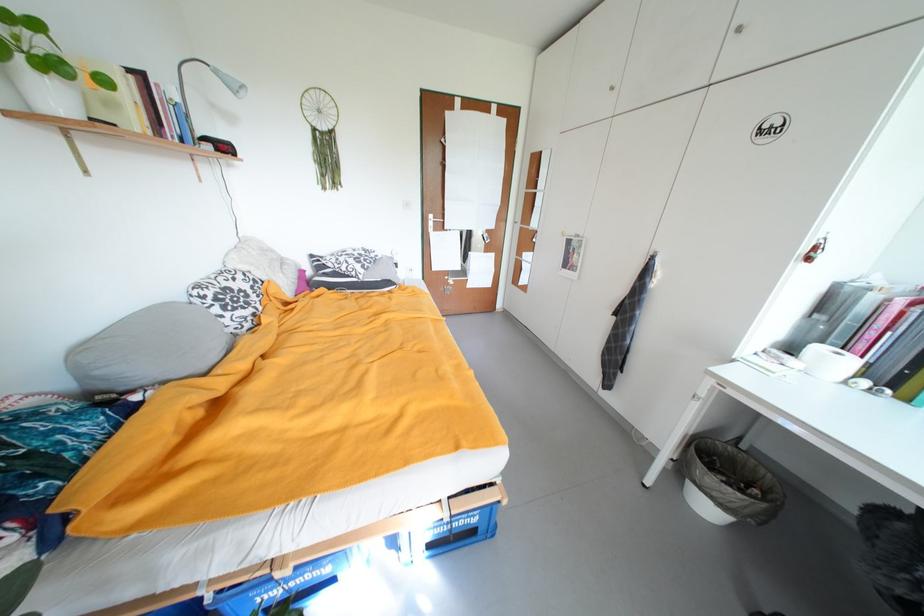
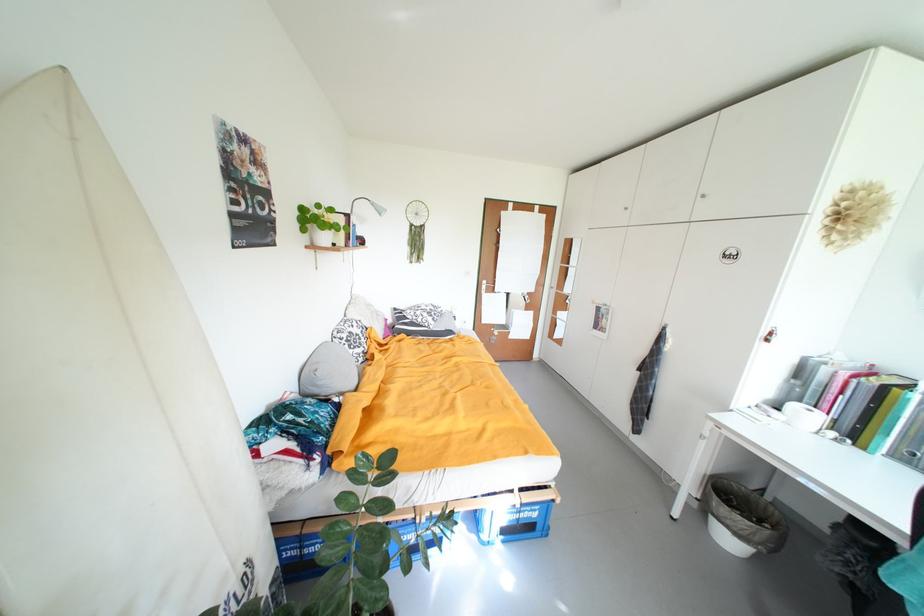
Question: How did the camera likely rotate?

Choices:
 (A) Left
 (B) Right
 (C) Up
 (D) Down

Answer: (C)